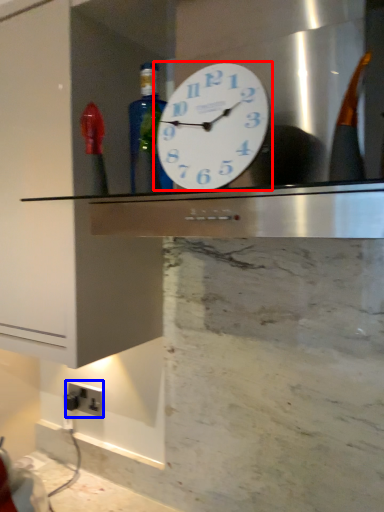
Question: Which object appears farthest to the camera in this image, wall clock (highlighted by a red box) or electric outlet (highlighted by a blue box)?

Choices:
 (A) wall clock
 (B) electric outlet

Answer: (B)